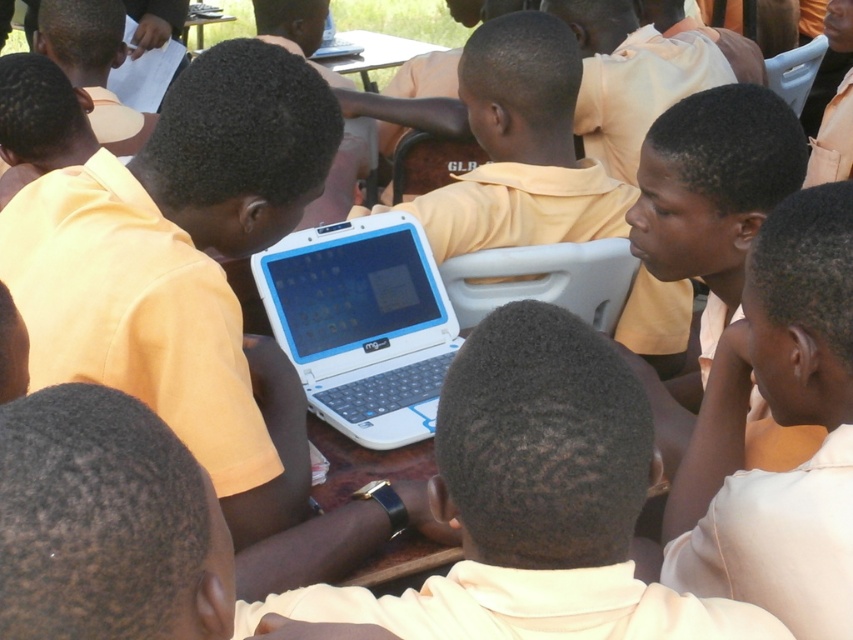
Based on the photo, you are a teacher planning to distribute materials to two laptops. The laptops are the white plastic laptop at center and the white plastic laptop at upper center. If you need to walk 10 feet to get the materials, which laptop should you go to first to minimize the total distance walked?

The white plastic laptop at center is closer to the teacher than the white plastic laptop at upper center, so the teacher should go to the white plastic laptop at center first to minimize the total distance walked.

You are a photographer aiming to capture a photo of the white plastic table at upper center and the matte yellow shirt at right. From the photographer perspective, which object is positioned to the right side of the scene?

The matte yellow shirt at right is positioned to the right of the white plastic table at upper center, so the matte yellow shirt at right is on the right side of the scene.